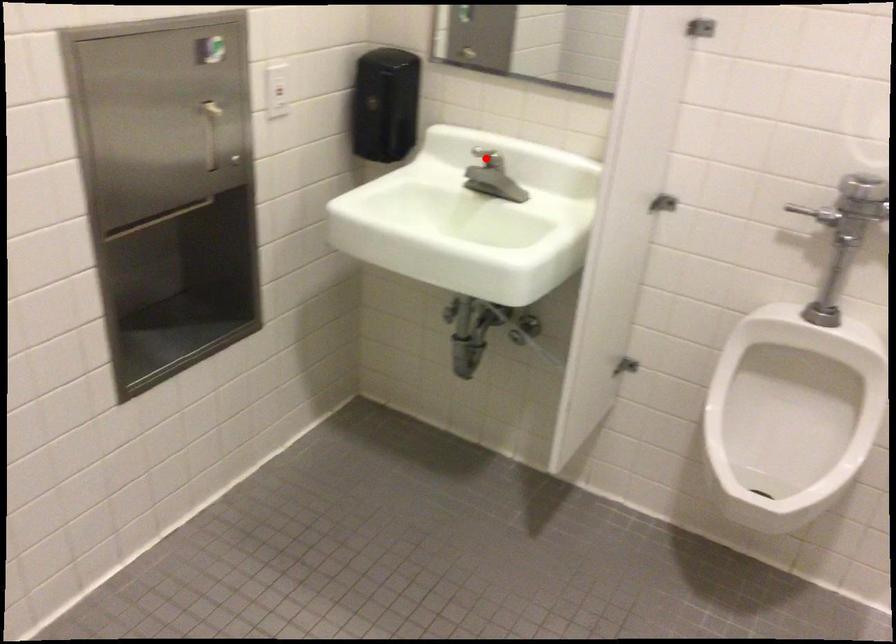
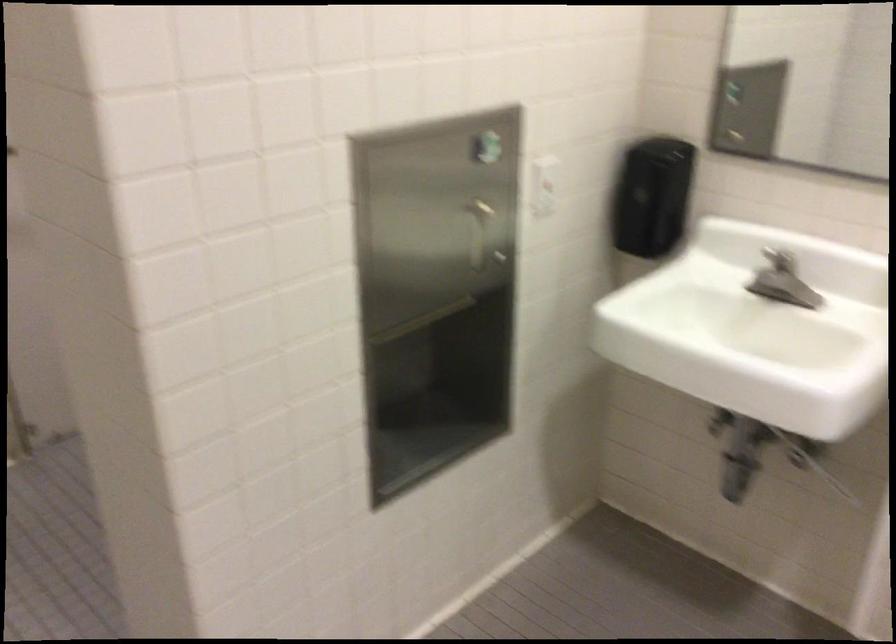
Question: I am providing you with two images of the same scene from different viewpoints. In image1, a red point is highlighted. Considering the same 3D point in image2, which of the following is correct?

Choices:
 (A) It is closer
 (B) It is farther

Answer: (A)